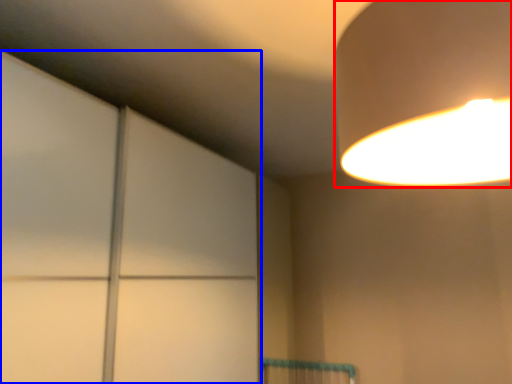
Question: Which point is further to the camera, lamp (highlighted by a red box) or glass door (highlighted by a blue box)?

Choices:
 (A) lamp
 (B) glass door

Answer: (B)